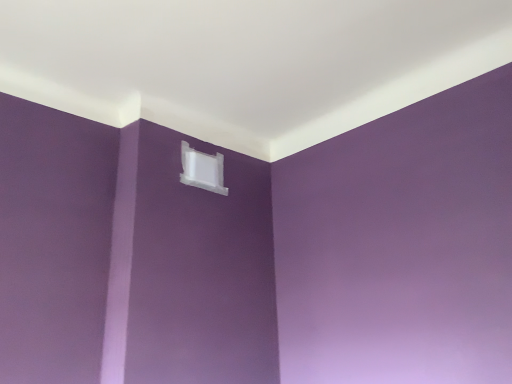
Measure the distance between point [212,185] and camera.

The depth of point [212,185] is 7.66 feet.

Image resolution: width=512 pixels, height=384 pixels. What do you see at coordinates (202, 170) in the screenshot? I see `transparent plastic window at upper center` at bounding box center [202, 170].

Locate an element on the screen. transparent plastic window at upper center is located at coordinates (202, 170).

In order to face transparent plastic window at upper center, should I rotate leftwards or rightwards?

A 6.356 degree turn to the left will do.

This screenshot has height=384, width=512. Identify the location of transparent plastic window at upper center. (202, 170).